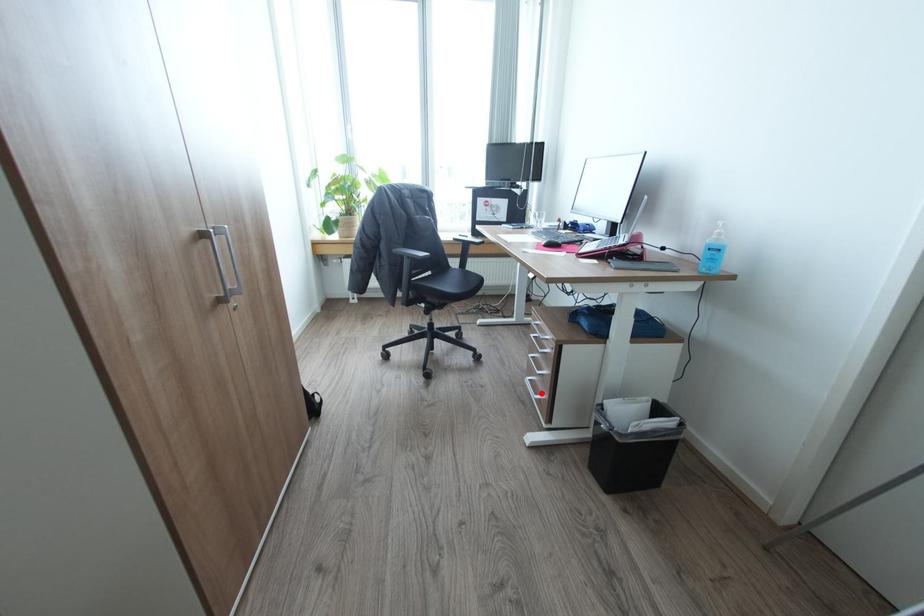
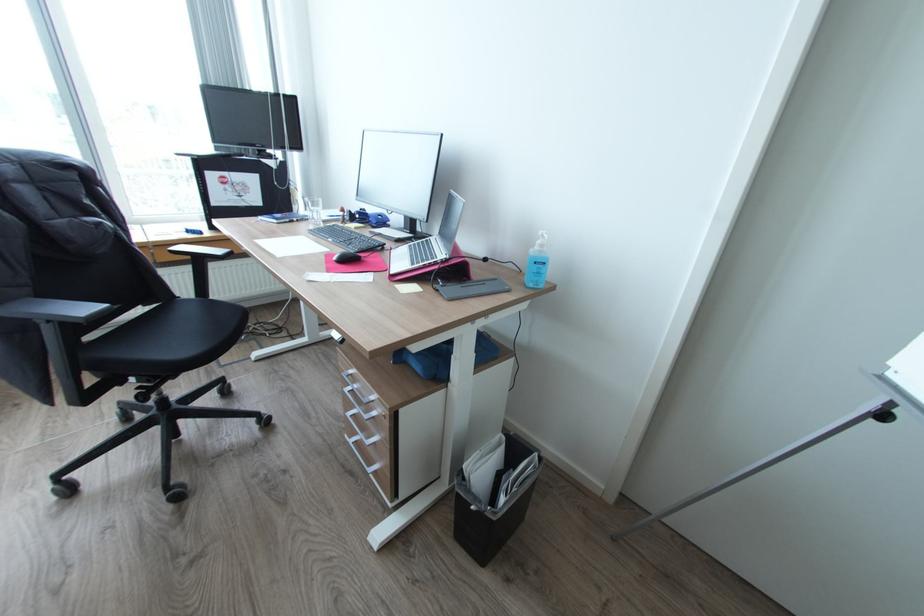
Question: I am providing you with two images of the same scene from different viewpoints. In image1, a red point is highlighted. Considering the same 3D point in image2, which of the following is correct?

Choices:
 (A) It is closer
 (B) It is farther

Answer: (B)